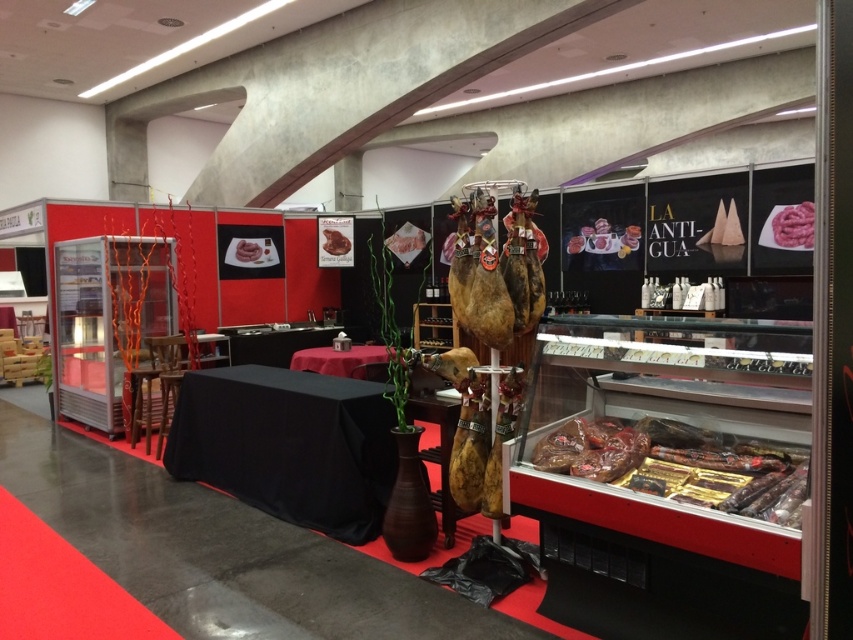
Does black fabric table at center appear on the left side of pink glossy meat at center?

No, black fabric table at center is not to the left of pink glossy meat at center.

Find the location of a particular element. The image size is (853, 640). black fabric table at center is located at coordinates (288, 444).

Can you confirm if shiny brown sausages at right is thinner than pink glossy meat at center?

Incorrect, shiny brown sausages at right's width is not less than pink glossy meat at center's.

In the scene shown: Does shiny brown sausages at right come in front of pink glossy meat at center?

Yes, it is in front of pink glossy meat at center.

You are a GUI agent. You are given a task and a screenshot of the screen. Output one action in this format:
    pyautogui.click(x=<x>, y=<y>)
    Task: Click on the shiny brown sausages at right
    The image size is (853, 640).
    Given the screenshot: What is the action you would take?
    pyautogui.click(x=680, y=465)

Is point (331, 509) in front of point (393, 253)?

Yes, point (331, 509) is in front of point (393, 253).

The height and width of the screenshot is (640, 853). I want to click on black fabric table at center, so click(288, 444).